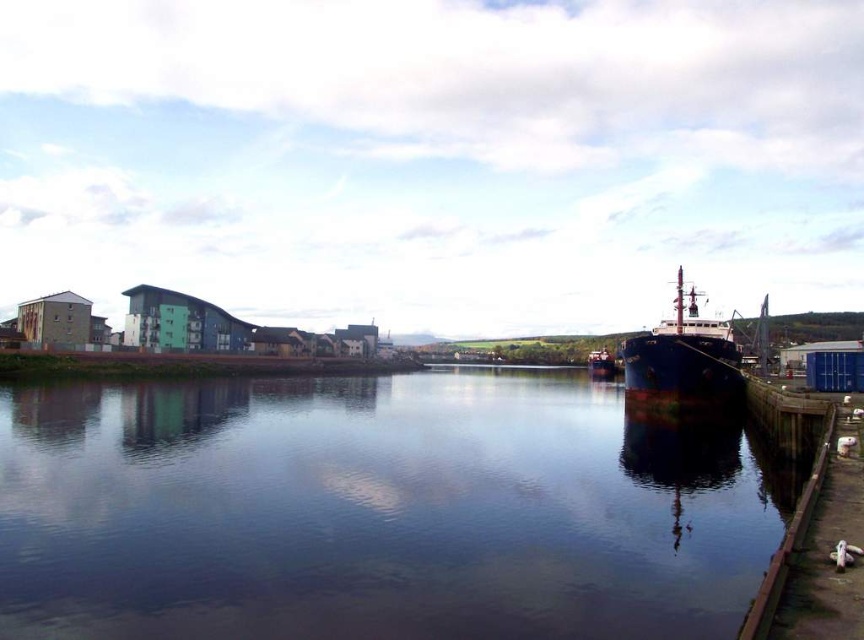
You are standing at the waterfront and want to take a photo that includes both the large blue ship docked at the pier and the row of modern buildings on the left. Which point, point (739, 608) or point (591, 364), should you focus on to ensure both the ship and buildings are in clear view?

You should focus on point (739, 608) because it is closer to the camera, allowing both the ship and buildings to be in clear view.

You are standing at the waterfront and want to take a photo that includes both the large blue ship docked at the pier and the row of modern buildings on the left. Which of the two points, point 1 at coordinates point (710, 400) or point 2 at coordinates point (592, 371), should you stand closer to in order to ensure both the ship and the buildings are in frame?

You should stand closer to point 1 at coordinates point (710, 400) because it is closer to the camera, allowing you to capture both the large blue ship docked at the pier and the row of modern buildings on the left in the frame.

You are standing at the point marked by the coordinates point (683, 358) in the image. What object are you facing?

You are facing the blue metallic ship at right.